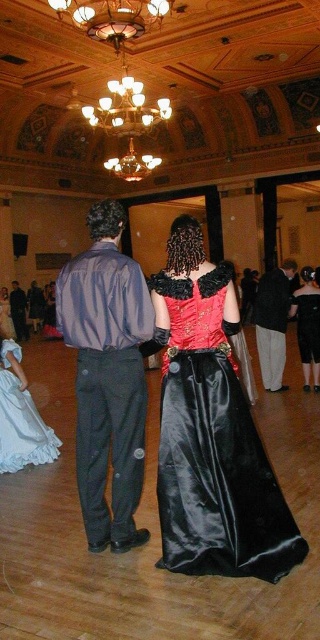
Question: Is matte gold chandelier at upper center further to camera compared to dark gray pants at right?

Choices:
 (A) no
 (B) yes

Answer: (B)

Question: Which point appears closest to the camera in this image?

Choices:
 (A) (221, 333)
 (B) (272, 308)
 (C) (19, 320)

Answer: (A)

Question: Considering the real-world distances, which object is farthest from the dark gray pants at right?

Choices:
 (A) black satin dress at lower right
 (B) white satin dress at lower left
 (C) matte gold chandelier at upper center

Answer: (C)

Question: Is white satin dress at lower left above dark gray pants at right?

Choices:
 (A) no
 (B) yes

Answer: (A)

Question: Can you confirm if matte gold chandelier at upper center is bigger than black satin dress at lower right?

Choices:
 (A) yes
 (B) no

Answer: (A)

Question: Considering the real-world distances, which object is farthest from the matte gold chandelier at upper center?

Choices:
 (A) shiny purple shirt at center
 (B) dark gray pants at right
 (C) shiny satin dress at center
 (D) white satin dress at lower left

Answer: (C)